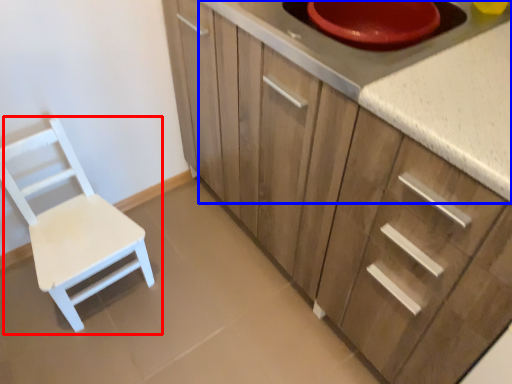
Question: Which object appears farthest to the camera in this image, chair (highlighted by a red box) or countertop (highlighted by a blue box)?

Choices:
 (A) chair
 (B) countertop

Answer: (A)